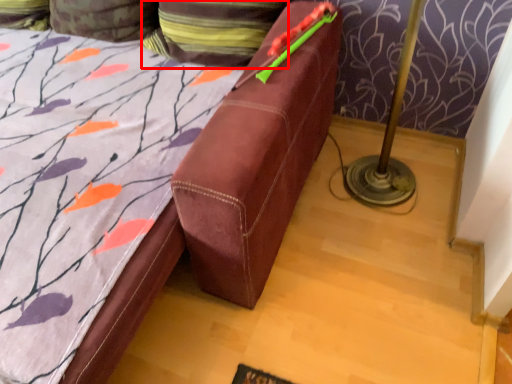
Question: From the image's perspective, what is the correct spatial positioning of pillow (annotated by the red box) in reference to pillow?

Choices:
 (A) above
 (B) below

Answer: (B)